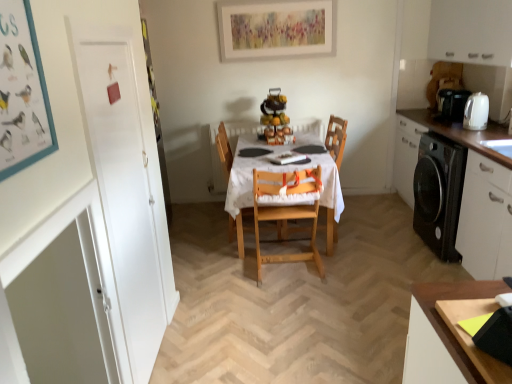
Question: Is wooden chair at center oriented away from wooden table at center?

Choices:
 (A) no
 (B) yes

Answer: (B)

Question: From a real-world perspective, is wooden chair at center below wooden table at center?

Choices:
 (A) no
 (B) yes

Answer: (A)

Question: Is wooden chair at center taller than wooden table at center?

Choices:
 (A) no
 (B) yes

Answer: (B)

Question: Is wooden chair at center behind wooden table at center?

Choices:
 (A) no
 (B) yes

Answer: (B)

Question: Considering the relative sizes of wooden chair at center and wooden table at center in the image provided, is wooden chair at center wider than wooden table at center?

Choices:
 (A) yes
 (B) no

Answer: (B)

Question: From the image's perspective, is wooden chair at center below wooden table at center?

Choices:
 (A) yes
 (B) no

Answer: (B)

Question: From a real-world perspective, is white matte cabinet at right, which appears as the 1th cabinetry when ordered from the bottom, located higher than wooden chair at center?

Choices:
 (A) no
 (B) yes

Answer: (A)

Question: Does white matte cabinet at right, which appears as the 1th cabinetry when ordered from the bottom, appear on the right side of wooden chair at center?

Choices:
 (A) yes
 (B) no

Answer: (A)

Question: Is white matte cabinet at right, which appears as the 1th cabinetry when ordered from the bottom, not close to wooden chair at center?

Choices:
 (A) no
 (B) yes

Answer: (A)

Question: Does white matte cabinet at right, which appears as the 1th cabinetry when ordered from the bottom, turn towards wooden chair at center?

Choices:
 (A) no
 (B) yes

Answer: (B)

Question: Does white matte cabinet at right, the 2th cabinetry in the top-to-bottom sequence, lie in front of wooden chair at center?

Choices:
 (A) yes
 (B) no

Answer: (A)

Question: Considering the relative sizes of white matte cabinet at right, the 2th cabinetry in the top-to-bottom sequence, and wooden chair at center in the image provided, is white matte cabinet at right, the 2th cabinetry in the top-to-bottom sequence, thinner than wooden chair at center?

Choices:
 (A) no
 (B) yes

Answer: (A)

Question: Is natural wood highchair at center, the 1th chair when ordered from front to back, inside wooden table at center?

Choices:
 (A) no
 (B) yes

Answer: (B)